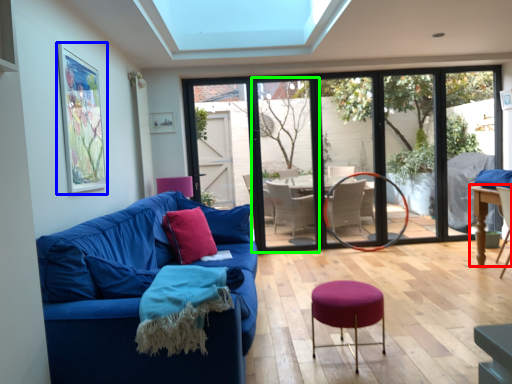
Question: Which object is positioned farthest from table (highlighted by a red box)? Select from picture frame (highlighted by a blue box) and screen door (highlighted by a green box).

Choices:
 (A) picture frame
 (B) screen door

Answer: (A)